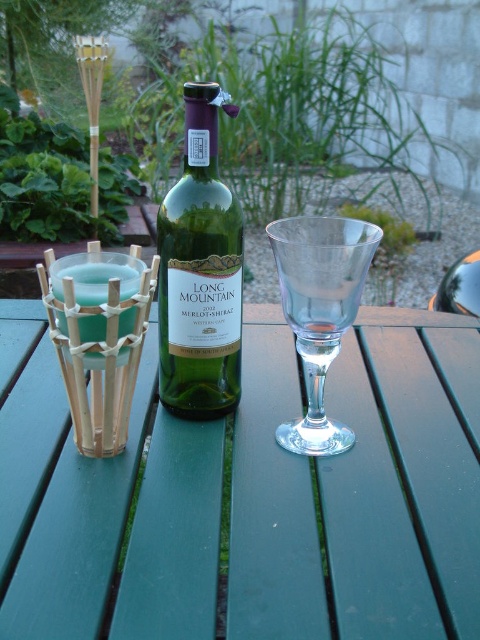
Question: Which point appears closest to the camera in this image?

Choices:
 (A) (214, 170)
 (B) (395, 582)
 (C) (332, 220)

Answer: (B)

Question: Which of the following is the farthest from the observer?

Choices:
 (A) (202, 428)
 (B) (192, 280)

Answer: (A)

Question: Considering the relative positions of green painted wood picnic table at center and transparent glass wine glass at center in the image provided, where is green painted wood picnic table at center located with respect to transparent glass wine glass at center?

Choices:
 (A) below
 (B) above

Answer: (A)

Question: Does green painted wood picnic table at center appear over green glass bottle at center?

Choices:
 (A) no
 (B) yes

Answer: (A)

Question: Among these points, which one is nearest to the camera?

Choices:
 (A) (208, 275)
 (B) (343, 356)

Answer: (A)

Question: Where is green painted wood picnic table at center located in relation to transparent glass wine glass at center in the image?

Choices:
 (A) below
 (B) above

Answer: (A)